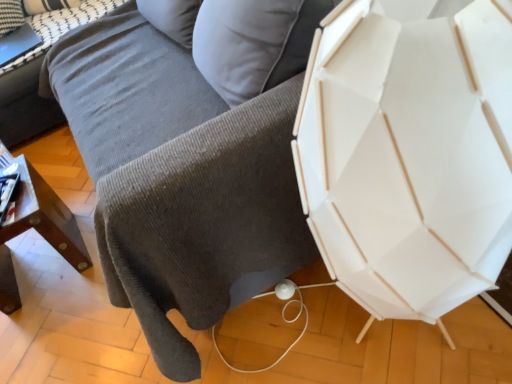
Question: Is wooden table at lower left bigger or smaller than gray corduroy couch at upper left?

Choices:
 (A) big
 (B) small

Answer: (B)

Question: Is wooden table at lower left inside the boundaries of gray corduroy couch at upper left, or outside?

Choices:
 (A) outside
 (B) inside

Answer: (A)

Question: Based on their relative distances, which object is nearer to the wooden table at lower left?

Choices:
 (A) white textured pillow at upper left
 (B) gray corduroy couch at upper left
 (C) gray corduroy couch at center

Answer: (C)

Question: Which object is positioned farthest from the gray corduroy couch at upper left?

Choices:
 (A) gray corduroy couch at center
 (B) wooden table at lower left
 (C) white textured pillow at upper left

Answer: (B)